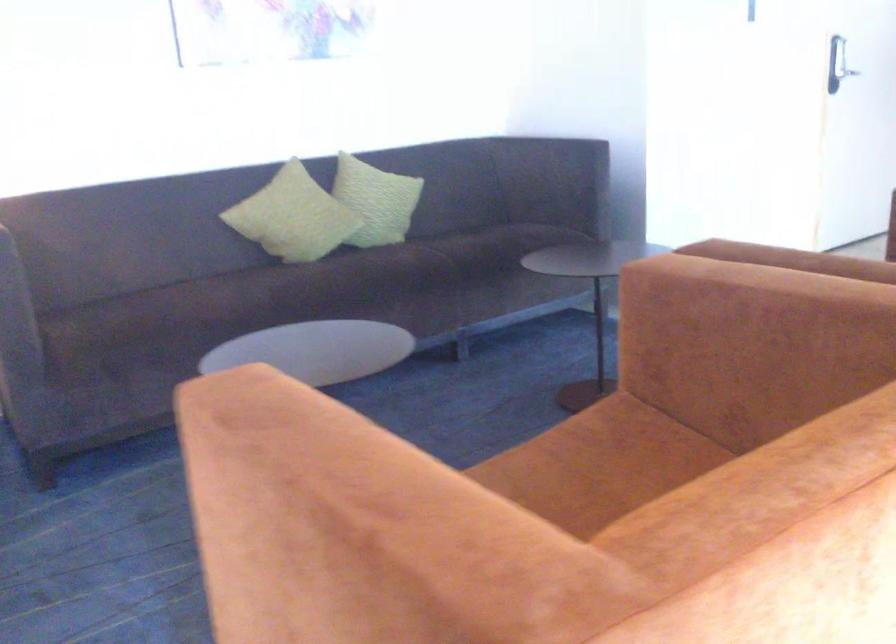
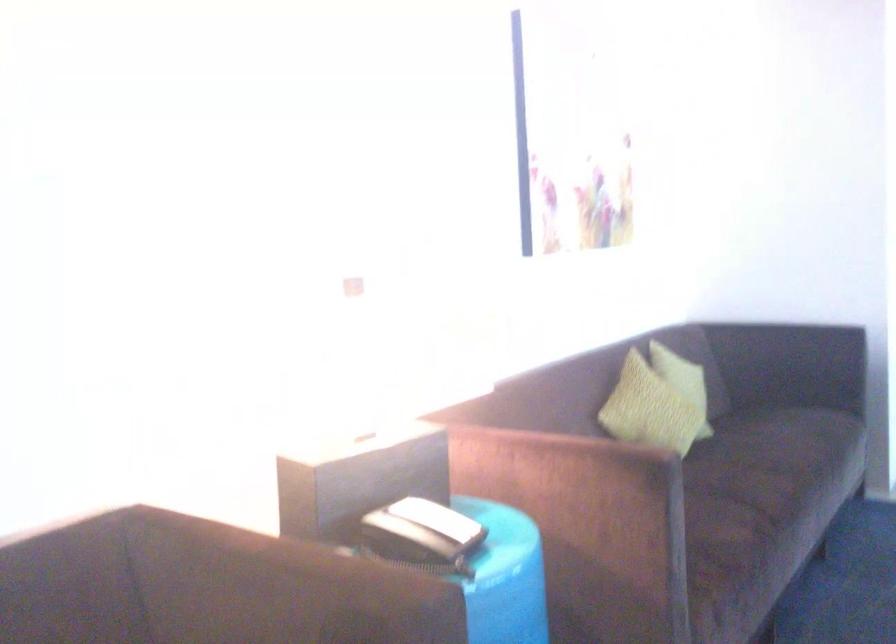
Where in the second image is the point corresponding to point 314,201 from the first image?

(683, 381)